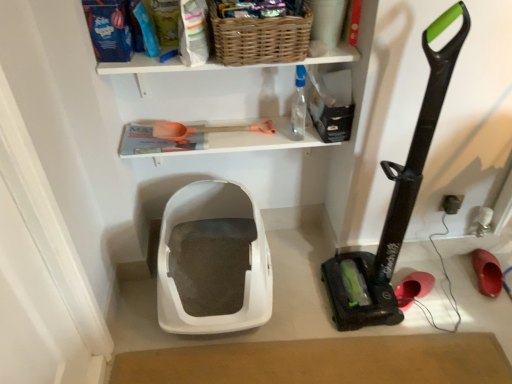
Where is `vacant space that is in between black plastic vacuum cleaner at right and white plastic litter box at center`? vacant space that is in between black plastic vacuum cleaner at right and white plastic litter box at center is located at coordinates (302, 284).